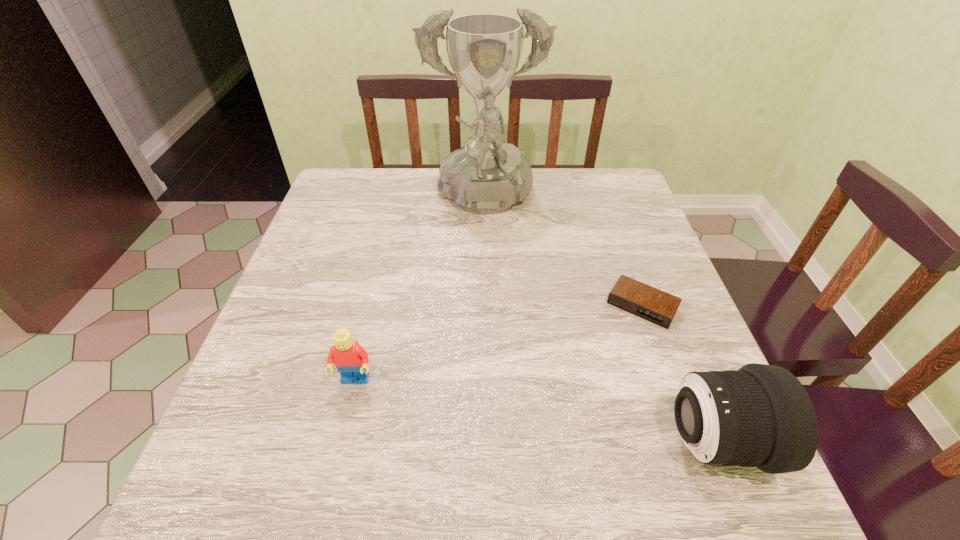
Locate an element on the screen. The image size is (960, 540). the leftmost object is located at coordinates (351, 359).

The image size is (960, 540). I want to click on the second shortest object, so click(x=351, y=359).

Find the location of `telephoto lens`. telephoto lens is located at coordinates (761, 416).

The height and width of the screenshot is (540, 960). I want to click on the second tallest object, so click(x=761, y=416).

The image size is (960, 540). I want to click on alarm clock, so click(x=656, y=306).

The image size is (960, 540). I want to click on the second farthest object, so click(x=656, y=306).

The width and height of the screenshot is (960, 540). Identify the location of award. (486, 176).

You are a GUI agent. You are given a task and a screenshot of the screen. Output one action in this format:
    pyautogui.click(x=<x>, y=<y>)
    Task: Click on the second object from left to right
    This screenshot has height=540, width=960.
    Given the screenshot: What is the action you would take?
    pyautogui.click(x=486, y=176)

Identify the location of free location located 0.120m on the front face of the alarm clock. Image resolution: width=960 pixels, height=540 pixels. (607, 364).

Where is `vacant point located 0.310m on the front face of the alarm clock`? vacant point located 0.310m on the front face of the alarm clock is located at coordinates (563, 441).